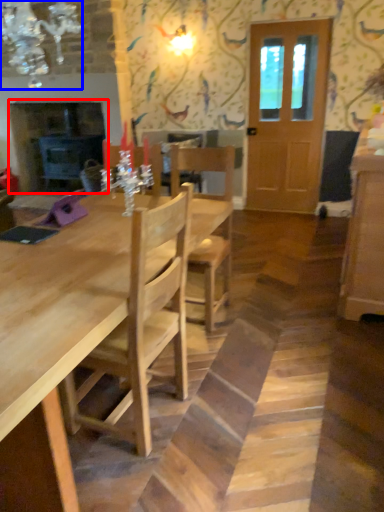
Question: Among these objects, which one is nearest to the camera, fireplace (highlighted by a red box) or light fixture (highlighted by a blue box)?

Choices:
 (A) fireplace
 (B) light fixture

Answer: (B)